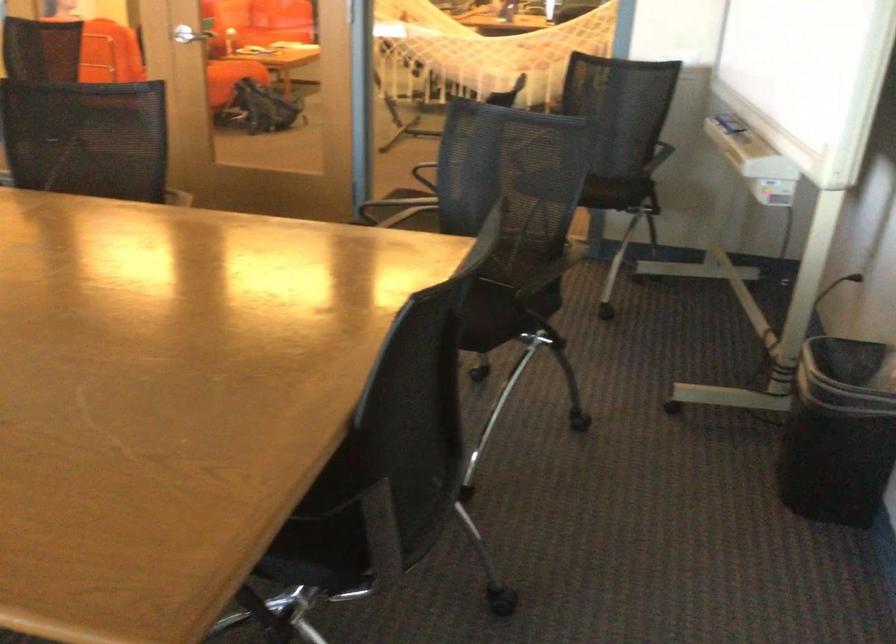
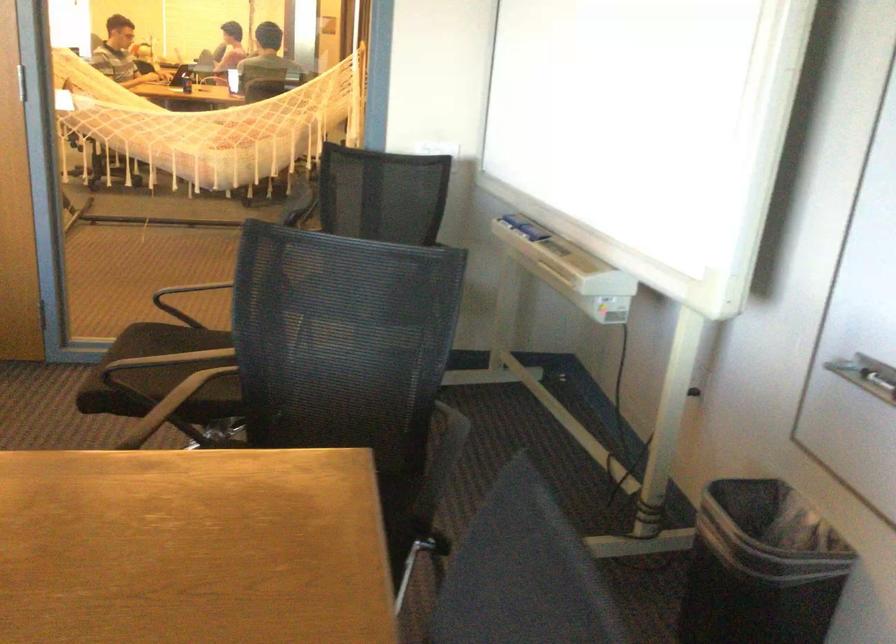
Question: The images are taken continuously from a first-person perspective. In which direction is your viewpoint rotating?

Choices:
 (A) Left
 (B) Right
 (C) Up
 (D) Down

Answer: (B)